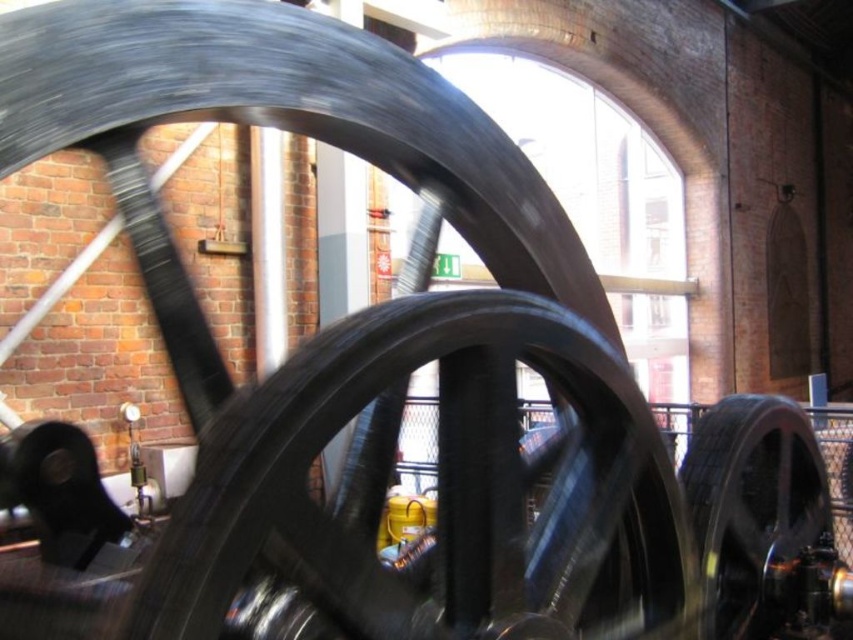
Based on the scene description, where is the black matte wheel at center positioned in terms of coordinates?

The black matte wheel at center is located at point (442, 484).

You are an engineer inspecting the wheels of a steam engine. You notice two wheels at the center of the engine, a black matte wheel at center and a shiny black wheel at center. Which wheel is located to the left of the other?

The black matte wheel at center is positioned on the left side of the shiny black wheel at center.

You are a maintenance worker standing 4 feet away from the black matte wheel at center. Can you safely reach out and touch it without moving closer?

The black matte wheel at center is 3.95 feet from the camera, so since you are standing 4 feet away, you are just slightly out of reach and would need to move closer to touch it.